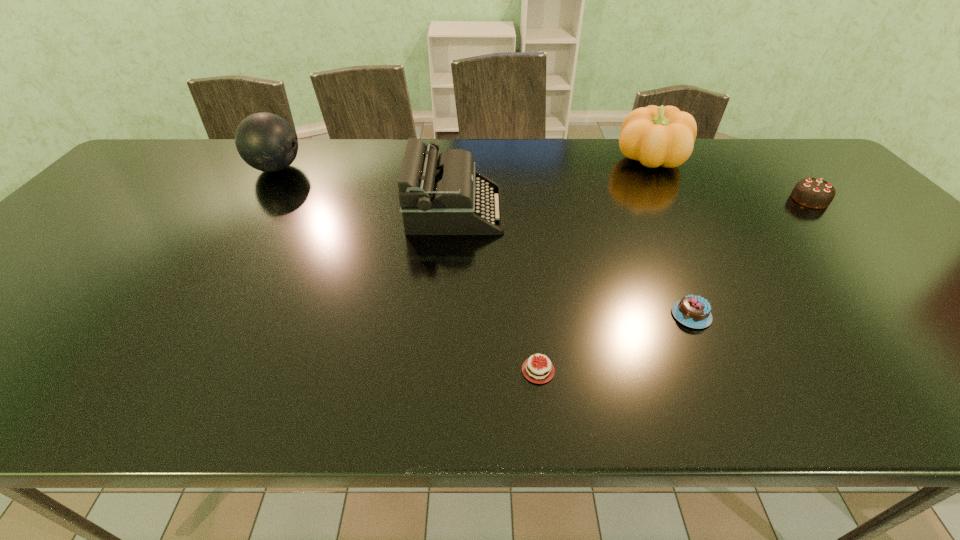
Locate an element on the screen. This screenshot has height=540, width=960. pumpkin is located at coordinates (656, 136).

Identify the location of bowling ball. (267, 142).

Where is `typewriter`? Image resolution: width=960 pixels, height=540 pixels. typewriter is located at coordinates (437, 195).

Identify the location of the third shortest object. The height and width of the screenshot is (540, 960). (814, 193).

This screenshot has height=540, width=960. I want to click on the tallest chocolate cake, so click(814, 193).

Where is `the second shortest object`? This screenshot has height=540, width=960. the second shortest object is located at coordinates (693, 311).

Where is `the fifth farthest object`? The width and height of the screenshot is (960, 540). the fifth farthest object is located at coordinates (693, 311).

Where is `the shortest chocolate cake`? the shortest chocolate cake is located at coordinates (535, 370).

The width and height of the screenshot is (960, 540). Identify the location of the leftmost chocolate cake. (535, 370).

Where is `blank space located on the front of the pumpkin`? blank space located on the front of the pumpkin is located at coordinates (701, 255).